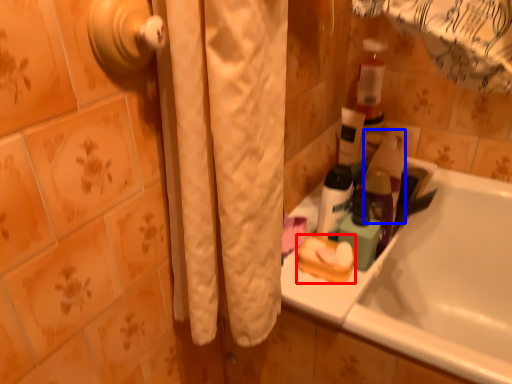
Question: Which point is further to the camera, product (highlighted by a red box) or cleaning product (highlighted by a blue box)?

Choices:
 (A) product
 (B) cleaning product

Answer: (B)